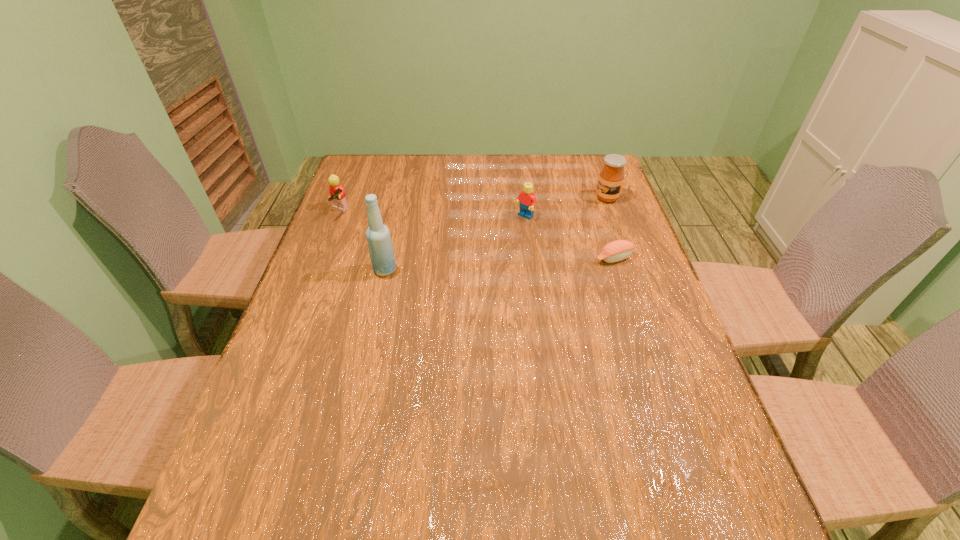
Where is `vacant spot on the desktop that is between the fourth object from right to left and the sushi and is positioned on the front-facing side of the honey`? vacant spot on the desktop that is between the fourth object from right to left and the sushi and is positioned on the front-facing side of the honey is located at coordinates (495, 264).

Locate an element on the screen. vacant space on the desktop that is between the bottle and the sushi and is positioned on the face of the third object from left to right is located at coordinates (468, 266).

Where is `free space on the desktop that is between the tallest object and the sushi and is positioned in front of the left Lego with the accessory visible`? Image resolution: width=960 pixels, height=540 pixels. free space on the desktop that is between the tallest object and the sushi and is positioned in front of the left Lego with the accessory visible is located at coordinates (480, 265).